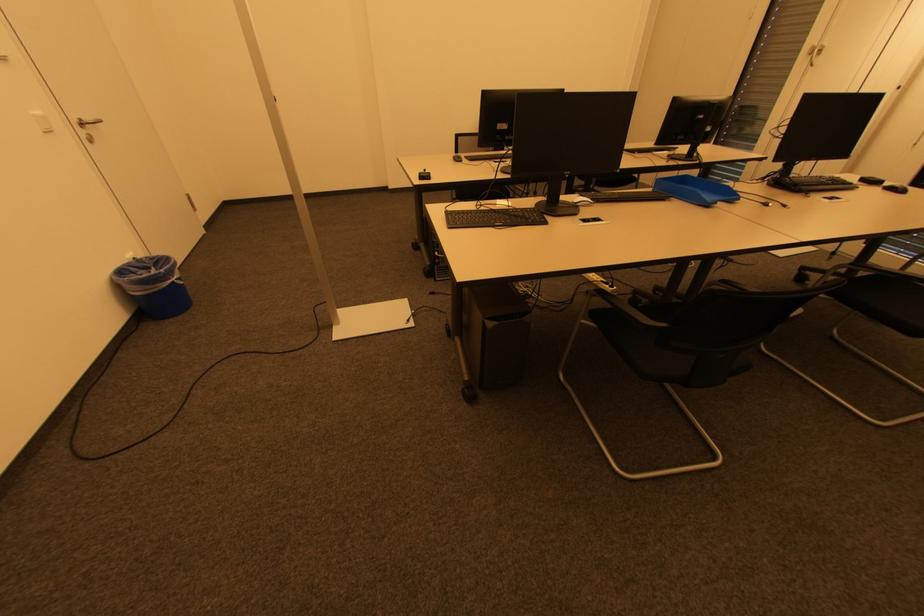
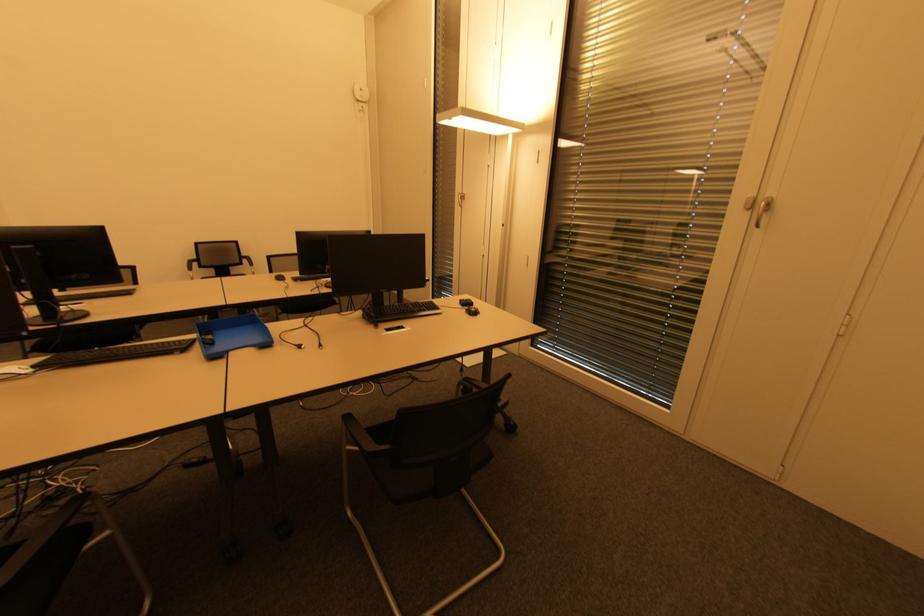
Question: The images are taken continuously from a first-person perspective. In which direction are you moving?

Choices:
 (A) Left
 (B) Right
 (C) Forward
 (D) Backward

Answer: (B)